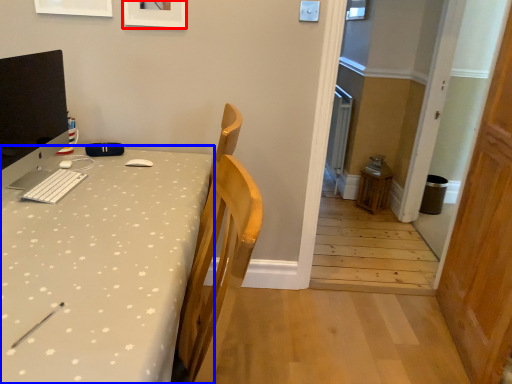
Question: Among these objects, which one is farthest to the camera, picture frame (highlighted by a red box) or desk (highlighted by a blue box)?

Choices:
 (A) picture frame
 (B) desk

Answer: (A)